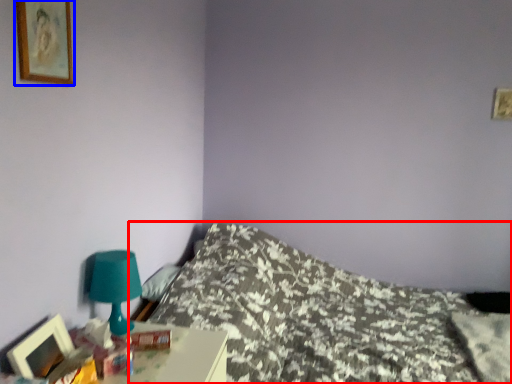
Question: Which point is closer to the camera, bed (highlighted by a red box) or picture frame (highlighted by a blue box)?

Choices:
 (A) bed
 (B) picture frame

Answer: (B)